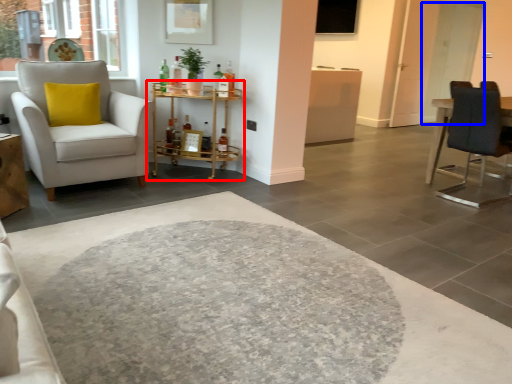
Question: Which point is closer to the camera, table (highlighted by a red box) or glass door (highlighted by a blue box)?

Choices:
 (A) table
 (B) glass door

Answer: (A)